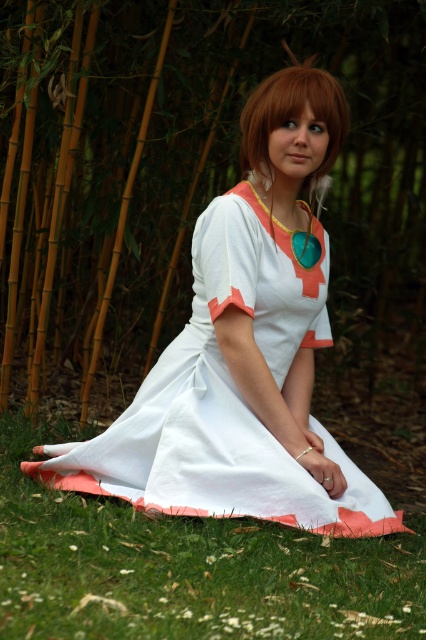
Can you confirm if green grass at lower center is wider than blonde hair at center?

Yes, green grass at lower center is wider than blonde hair at center.

Looking at this image, is green grass at lower center bigger than blonde hair at center?

Yes.

You are a GUI agent. You are given a task and a screenshot of the screen. Output one action in this format:
    pyautogui.click(x=<x>, y=<y>)
    Task: Click on the green grass at lower center
    This screenshot has height=640, width=426.
    Given the screenshot: What is the action you would take?
    pyautogui.click(x=187, y=568)

Is point (210, 508) behind point (264, 529)?

Yes, point (210, 508) is behind point (264, 529).

Is white cotton dress at center in front of green grass at lower center?

No, it is not.

Measure the distance between point (187, 428) and camera.

Point (187, 428) and camera are 10.27 feet apart.

At what (x,y) coordinates should I click in order to perform the action: click on white cotton dress at center. Please return your answer as a coordinate pair (x, y). The width and height of the screenshot is (426, 640). Looking at the image, I should click on (245, 348).

The height and width of the screenshot is (640, 426). Describe the element at coordinates (245, 348) in the screenshot. I see `white cotton dress at center` at that location.

Who is more distant from viewer, [199,225] or [296,97]?

The point [199,225] is behind.

Between point (109, 458) and point (253, 120), which one is positioned in front?

Point (109, 458) is in front.

Where is `white cotton dress at center`? This screenshot has width=426, height=640. white cotton dress at center is located at coordinates (245, 348).